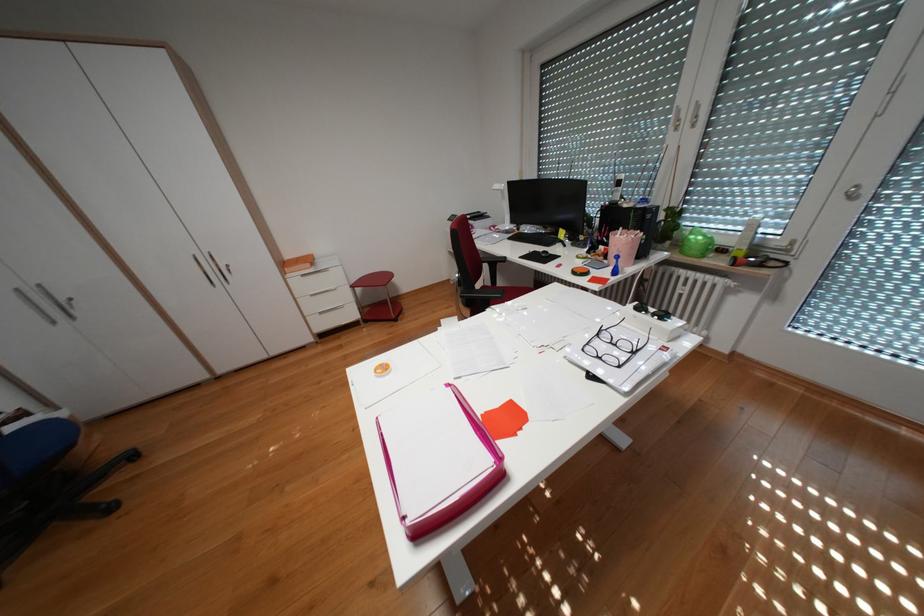
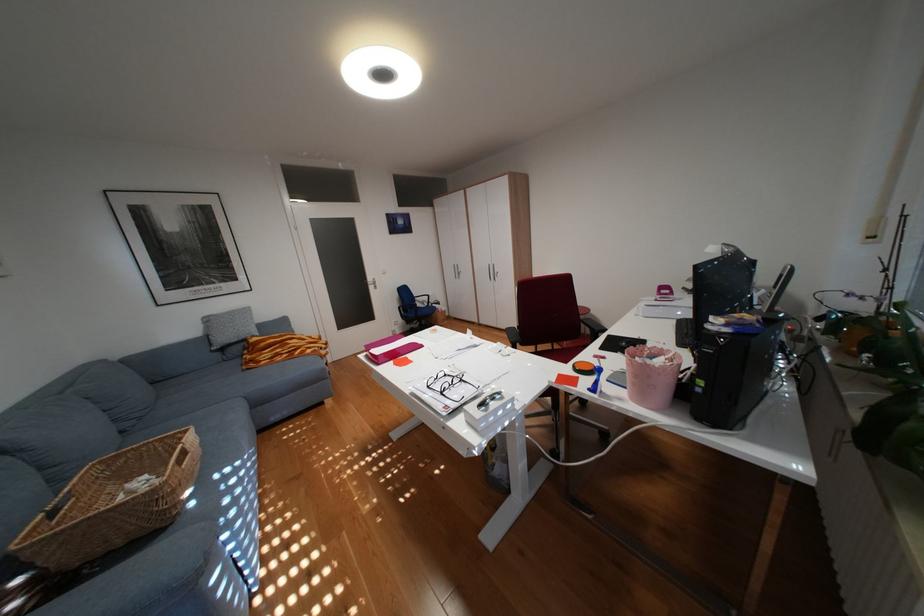
Find the pixel in the second image that matches point 647,352 in the first image.

(454, 392)